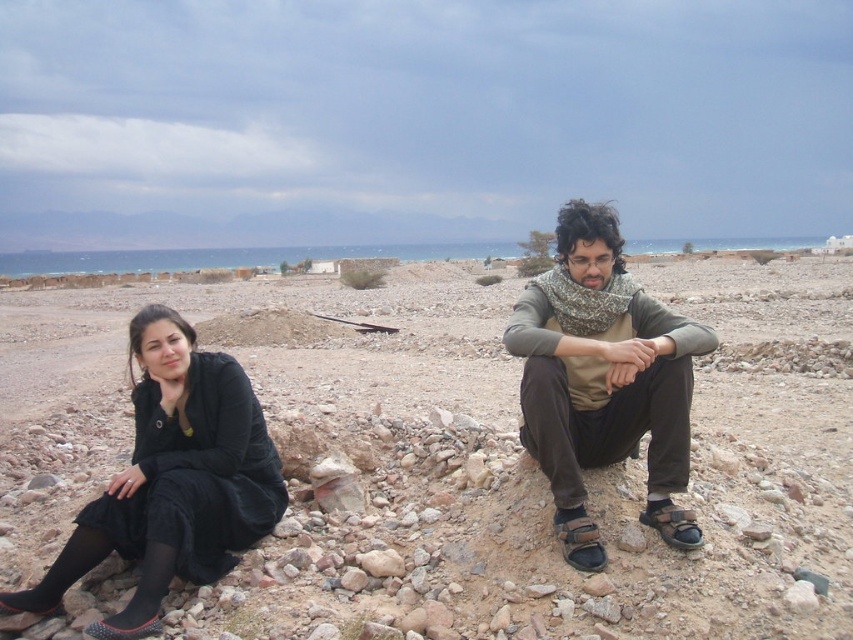
You are standing at the edge of the scene and want to walk towards the smooth sand beach at center and the matte brown scarf at center. Which object will you encounter first as you move forward?

The matte brown scarf at center will be encountered first because it is positioned to the left of the smooth sand beach at center, meaning it is closer to your starting point at the edge of the scene.